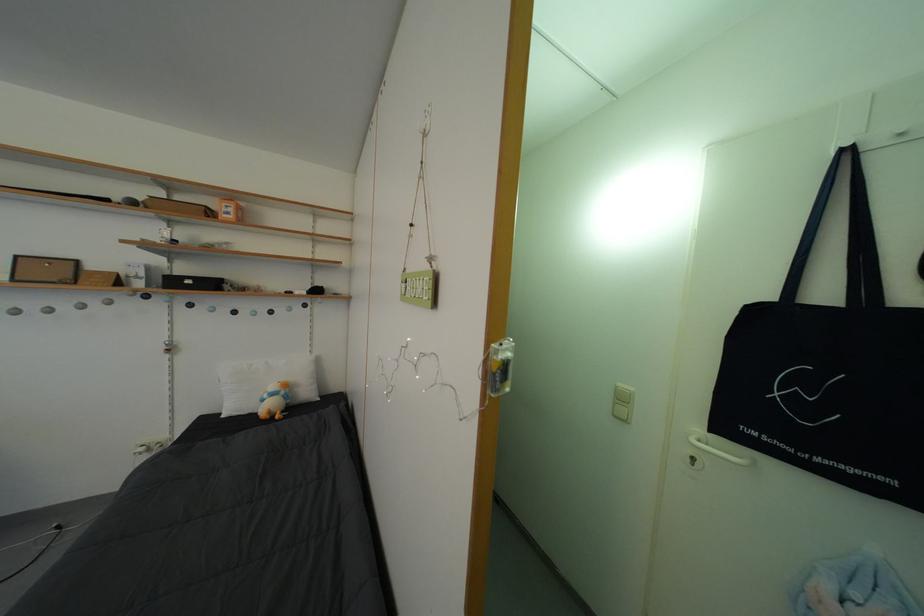
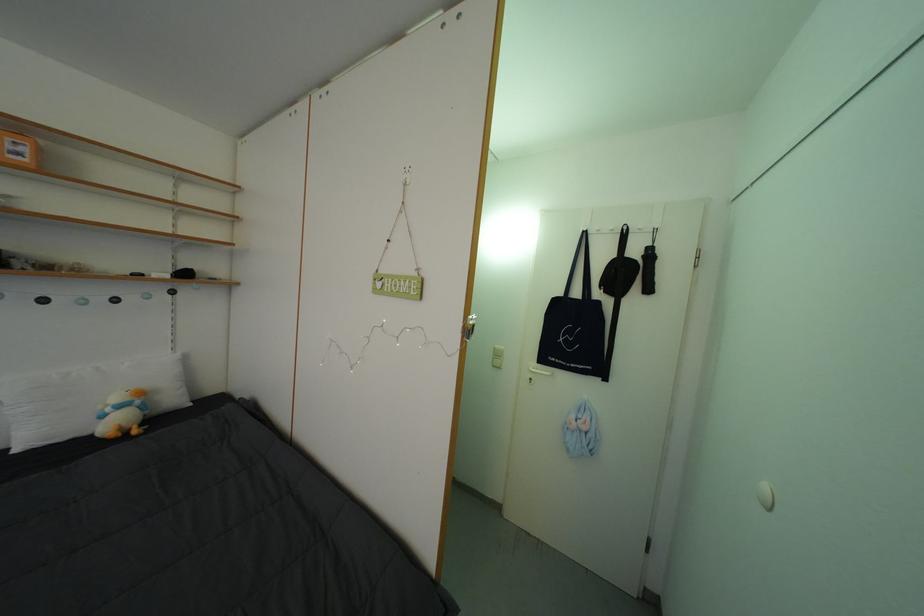
Locate, in the second image, the point that corresponds to the point at 720,437 in the first image.

(546, 369)